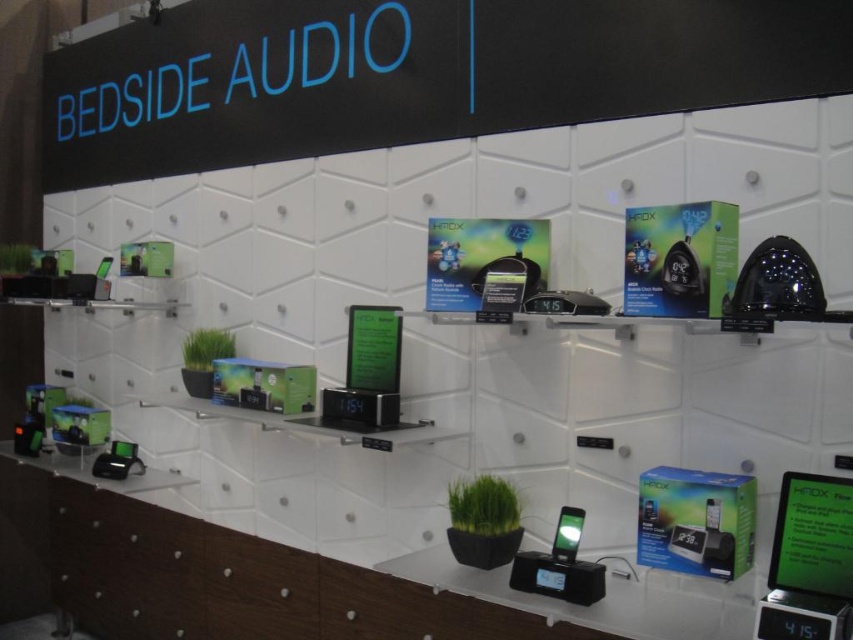
Question: Which point appears closest to the camera in this image?

Choices:
 (A) (566, 548)
 (B) (270, 29)

Answer: (A)

Question: Which point appears closest to the camera in this image?

Choices:
 (A) (126, 154)
 (B) (566, 547)

Answer: (B)

Question: Observing the image, what is the correct spatial positioning of black plastic sign at upper center in reference to matte black phone at center?

Choices:
 (A) below
 (B) above

Answer: (B)

Question: Can you confirm if black plastic sign at upper center is thinner than matte black phone at center?

Choices:
 (A) yes
 (B) no

Answer: (B)

Question: Considering the relative positions of black plastic sign at upper center and matte black phone at center in the image provided, where is black plastic sign at upper center located with respect to matte black phone at center?

Choices:
 (A) above
 (B) below

Answer: (A)